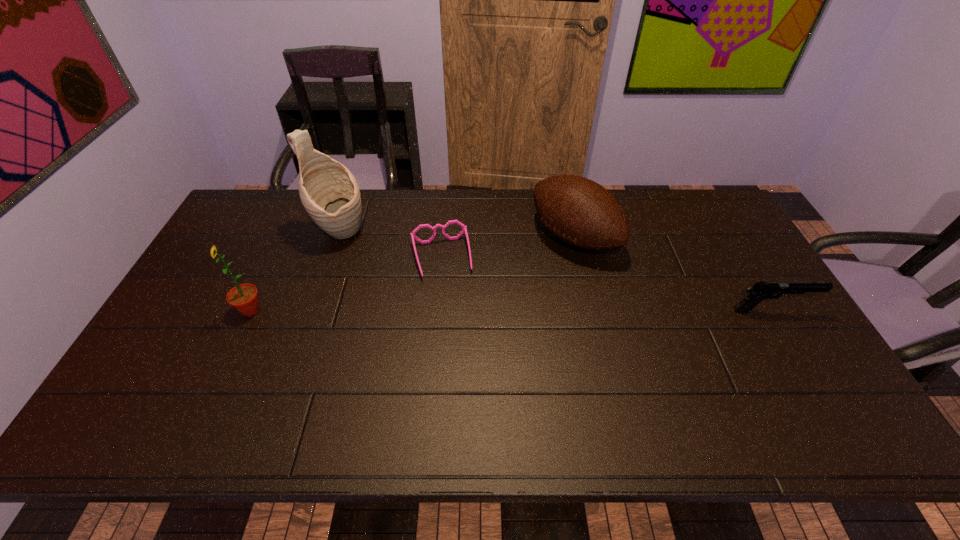
This screenshot has width=960, height=540. Identify the location of free space at the near right corner of the desktop. (793, 393).

Image resolution: width=960 pixels, height=540 pixels. Find the location of `empty location between the spectacles and the second shortest object`. empty location between the spectacles and the second shortest object is located at coordinates (607, 284).

Identify the location of empty space between the leftmost object and the third shortest object. (413, 274).

Where is `vacant region between the sunflower and the pitcher`? This screenshot has height=540, width=960. vacant region between the sunflower and the pitcher is located at coordinates (295, 272).

Find the location of a particular element. The image size is (960, 540). empty space between the gun and the pitcher is located at coordinates 556,272.

At what (x,y) coordinates should I click in order to perform the action: click on vacant space in between the sunflower and the third object from left to right. Please return your answer as a coordinate pair (x, y). The width and height of the screenshot is (960, 540). Looking at the image, I should click on (346, 284).

Image resolution: width=960 pixels, height=540 pixels. What are the coordinates of `free spot between the football and the gun` in the screenshot? It's located at (673, 274).

Locate an element on the screen. Image resolution: width=960 pixels, height=540 pixels. unoccupied position between the spectacles and the rightmost object is located at coordinates (607, 284).

The height and width of the screenshot is (540, 960). I want to click on free space between the second object from left to right and the third tallest object, so click(457, 235).

You are a GUI agent. You are given a task and a screenshot of the screen. Output one action in this format:
    pyautogui.click(x=<x>, y=<y>)
    Task: Click on the free space between the sunflower and the third shortest object
    The image size is (960, 540).
    Given the screenshot: What is the action you would take?
    pyautogui.click(x=413, y=274)